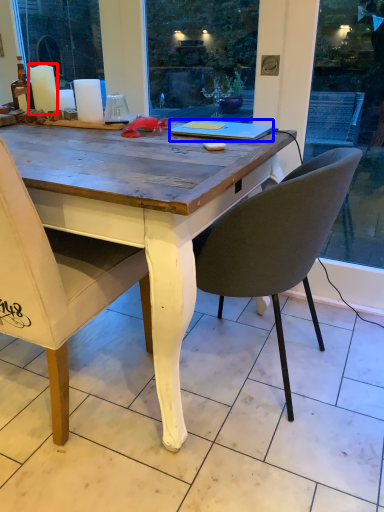
Question: Which object is further to the camera taking this photo, candle (highlighted by a red box) or laptop (highlighted by a blue box)?

Choices:
 (A) candle
 (B) laptop

Answer: (A)